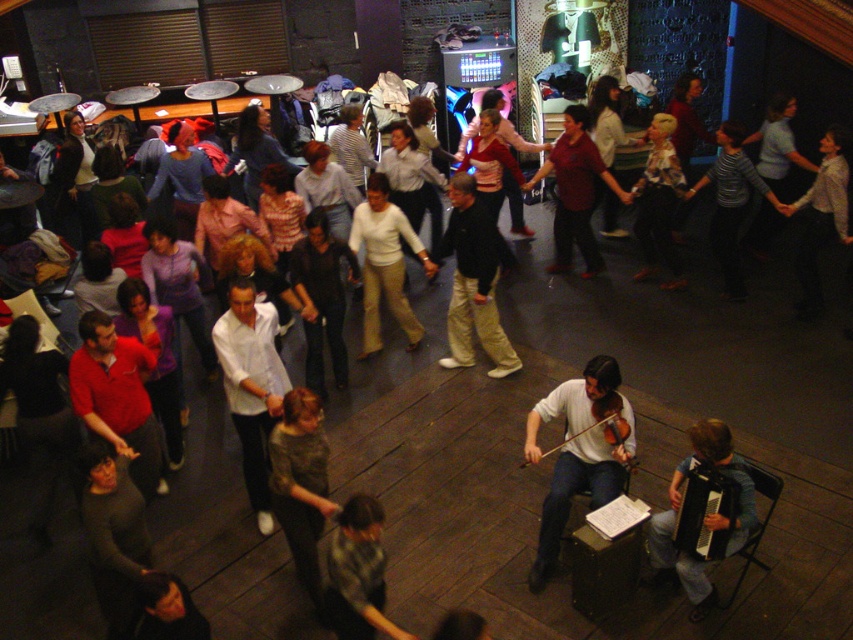
Question: Does white matte violin at lower center appear over white matte shirt at center?

Choices:
 (A) no
 (B) yes

Answer: (A)

Question: Is light brown wooden accordion at lower right positioned before white matte pants at center?

Choices:
 (A) yes
 (B) no

Answer: (A)

Question: Which of the following is the farthest from the observer?

Choices:
 (A) (341, 573)
 (B) (695, 458)

Answer: (B)

Question: Which object is closer to the camera taking this photo?

Choices:
 (A) white matte shirt at center
 (B) gray fabric shirt at lower center

Answer: (B)

Question: Is light brown wooden accordion at lower right smaller than gray fabric shirt at lower center?

Choices:
 (A) no
 (B) yes

Answer: (A)

Question: Based on their relative distances, which object is farther from the white matte violin at lower center?

Choices:
 (A) matte red shirt at center
 (B) white matte shirt at center
 (C) light brown wooden accordion at lower right

Answer: (A)